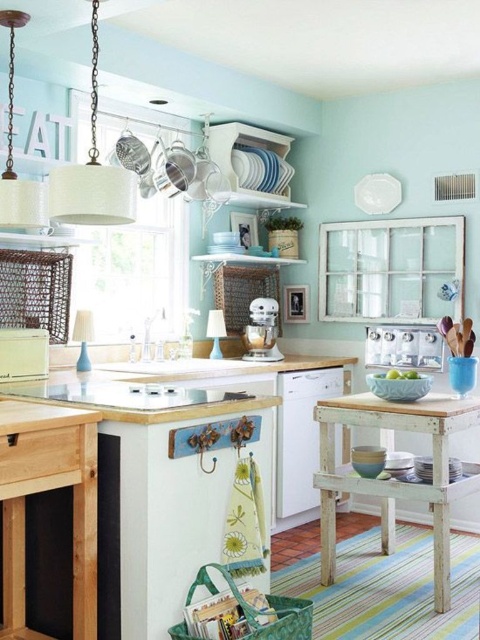
You are standing in the kitchen and need to place a new appliance on the white distressed wood table at lower right. Based on the scene description, can you determine the exact location coordinates where the table is positioned?

The white distressed wood table at lower right is located at point [395,480], so you can place the appliance there.

You are planning to place a rectangular cutting board on either the white distressed wood table at lower right or the white glossy sink at center. Based on their widths, which surface would be more suitable for placing the cutting board without overhanging the edges?

The white distressed wood table at lower right has a greater width than the white glossy sink at center, so placing the rectangular cutting board on the white distressed wood table at lower right would be more suitable to avoid overhanging the edges.